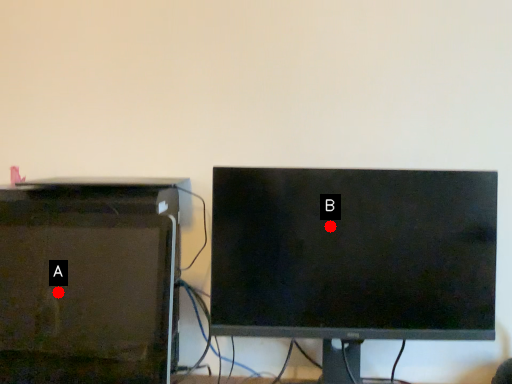
Question: Two points are circled on the image, labeled by A and B beside each circle. Among these points, which one is nearest to the camera?

Choices:
 (A) A is closer
 (B) B is closer

Answer: (A)